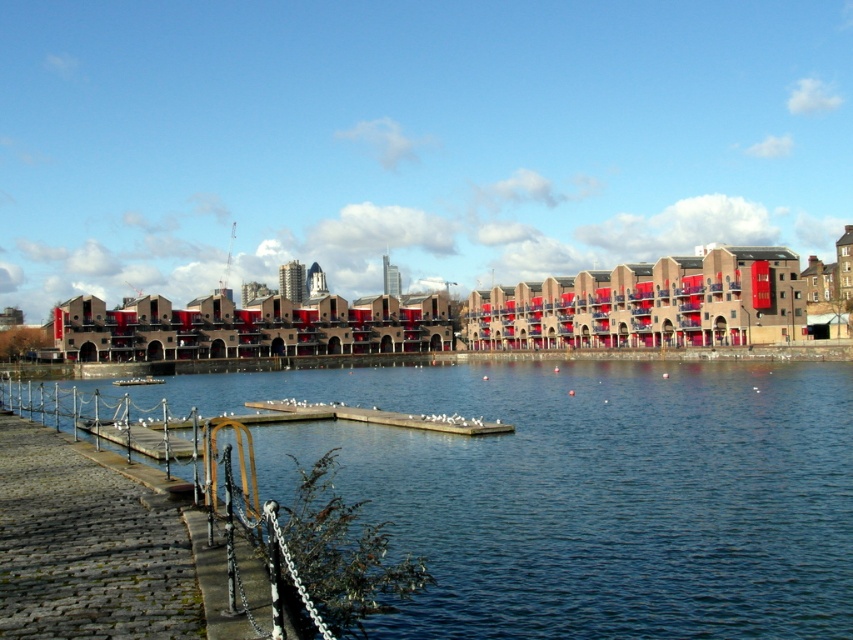
Is point (680, 616) positioned in front of point (251, 632)?

No, (680, 616) is further to viewer.

At what (x,y) coordinates should I click in order to perform the action: click on smooth concrete dock at lower left. Please return your answer as a coordinate pair (x, y). The width and height of the screenshot is (853, 640). Looking at the image, I should click on (583, 492).

Locate an element on the screen. brown cobblestone dock at lower left is located at coordinates (94, 548).

Which is in front, point (546, 586) or point (125, 380)?

Positioned in front is point (546, 586).

Which is in front, point (844, 628) or point (132, 381)?

Point (844, 628) is more forward.

I want to click on smooth concrete dock at lower left, so click(x=583, y=492).